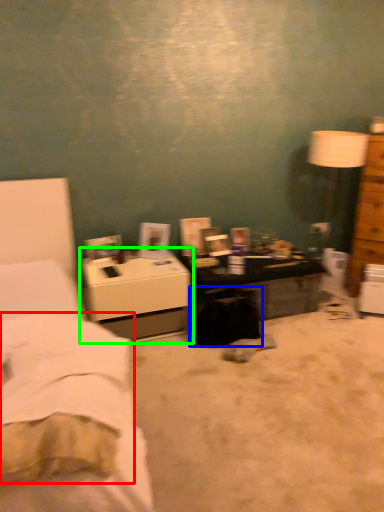
Question: Which object is the farthest from sheet (highlighted by a red box)? Choose among these: swivel chair (highlighted by a blue box) or nightstand (highlighted by a green box).

Choices:
 (A) swivel chair
 (B) nightstand

Answer: (A)